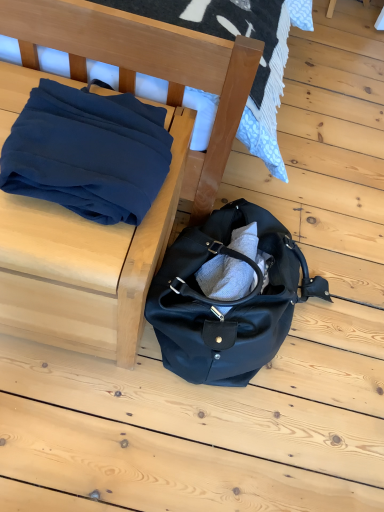
Question: Is matte blue fabric at left in front of or behind navy blue fabric at upper left in the image?

Choices:
 (A) behind
 (B) front

Answer: (B)

Question: From the image's perspective, is matte blue fabric at left located above or below navy blue fabric at upper left?

Choices:
 (A) above
 (B) below

Answer: (B)

Question: Which is farther from the navy blue fabric at upper left?

Choices:
 (A) matte black duffel bag at lower center
 (B) matte blue fabric at left

Answer: (A)

Question: Estimate the real-world distances between objects in this image. Which object is closer to the navy blue fabric at upper left?

Choices:
 (A) matte blue fabric at left
 (B) matte black duffel bag at lower center

Answer: (A)